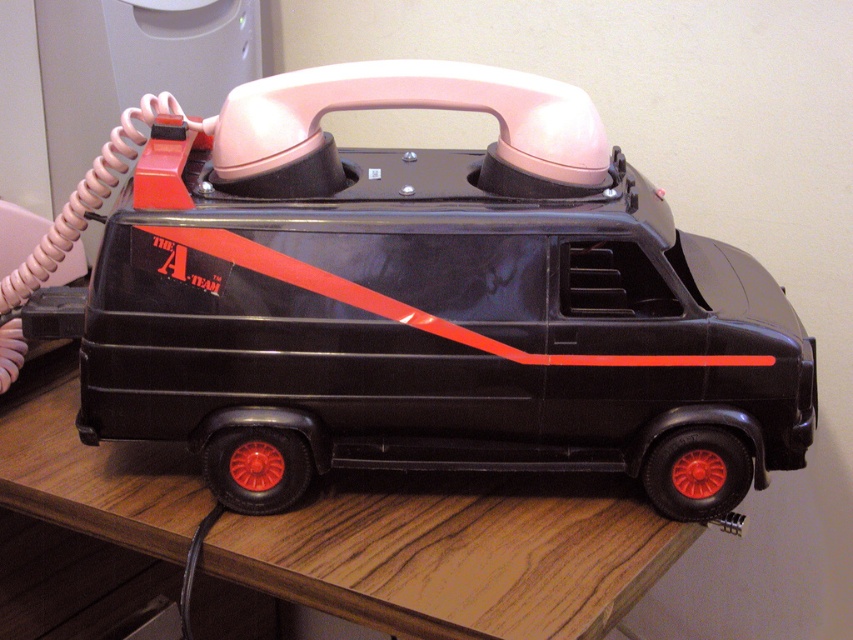
Where is the black plastic van at center located in the image?

The black plastic van at center is located at point coordinates of approximately 0.473 on the x axis and 0.504 on the y axis.

You have a small toy that needs to be placed between the black plastic van at center and the wooden table at lower center. The toy is 6 inches long. Will it fit in the space between them?

The black plastic van at center is 6.48 inches from the wooden table at lower center, so the 6 inch toy will fit between them since the space is slightly larger than the toy.

You are a delivery robot trying to place a package on the black plastic van at center. The package must be placed at the exact point with coordinates point (x=428, y=301). Can you confirm if this point is on the van?

Yes, the point (x=428, y=301) is on the black plastic van at center, so the package can be placed there.